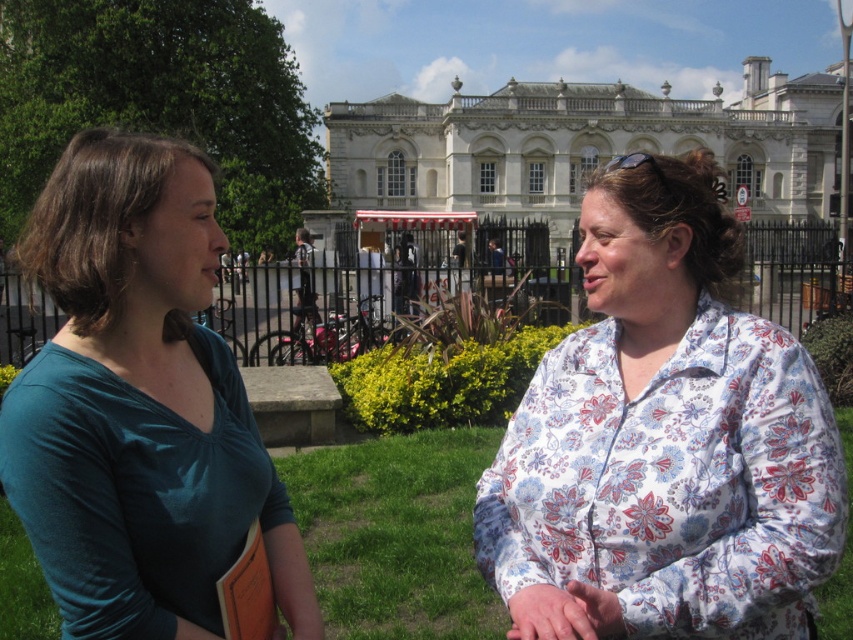
You are a photographer trying to capture a photo of both the floral cotton shirt at center and the teal fabric shirt at left. Since you want them both in the frame, which direction should you move to ensure both shirts are visible?

The floral cotton shirt at center is to the right of the teal fabric shirt at left. To include both in the frame, move to the left side so that you can capture both shirts in the photo.

You are a photographer trying to capture the two people in the image. Since the floral cotton shirt at center and the white glossy building at center are both in the frame, which one is closer to the camera?

The floral cotton shirt at center is positioned under the white glossy building at center, meaning the shirt is closer to the camera than the building.